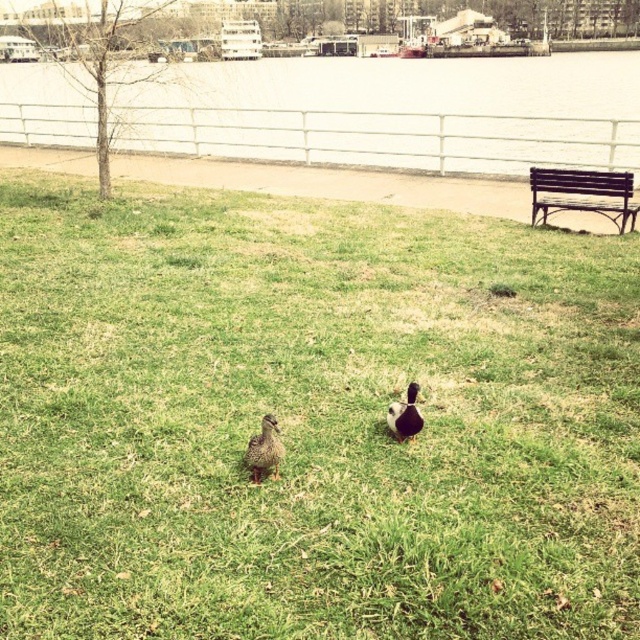
You are a park visitor who wants to take a photo of the brown speckled feathers at center and the brown fuzzy duck at center. Since you want to ensure both are in focus, you need to know which one is closer to you. Can you determine which object is nearer?

The brown speckled feathers at center is taller than brown fuzzy duck at center, so the brown fuzzy duck at center is closer to you because objects that are closer appear larger in height.

From the picture: You are standing at the center of the grassy area in the riverside park. You notice the brown speckled feathers at center. Can you determine the direction you need to walk to reach them?

The brown speckled feathers at center are located at coordinates point (264, 449). Since you are at the center of the grassy area, you should walk towards the direction of the coordinates to reach them. However, without a specific direction reference, it is difficult to determine the exact path. Please provide more information about the layout or landmarks in the scene.